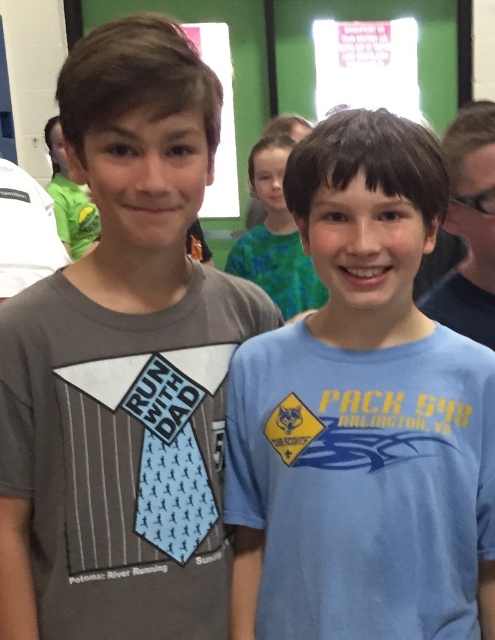
Which of these two, gray cotton shirt at center or green matte shirt at center, stands taller?

Standing taller between the two is gray cotton shirt at center.

Is point (9, 563) more distant than point (230, 264)?

No, (9, 563) is in front of (230, 264).

Which is in front, point (135, 96) or point (264, 228)?

Point (135, 96) is in front.

Identify the location of gray cotton shirt at center. The image size is (495, 640). (124, 365).

Is point (205, 100) behind point (424, 614)?

No, it is not.

Identify the location of gray cotton shirt at center. This screenshot has height=640, width=495. (124, 365).

The image size is (495, 640). In order to click on gray cotton shirt at center in this screenshot , I will do `click(124, 365)`.

Does blue cotton shirt at center appear on the right side of green matte shirt at center?

Indeed, blue cotton shirt at center is positioned on the right side of green matte shirt at center.

Is blue cotton shirt at center below green matte shirt at center?

Yes, blue cotton shirt at center is below green matte shirt at center.

The image size is (495, 640). What are the coordinates of `blue cotton shirt at center` in the screenshot? It's located at (362, 417).